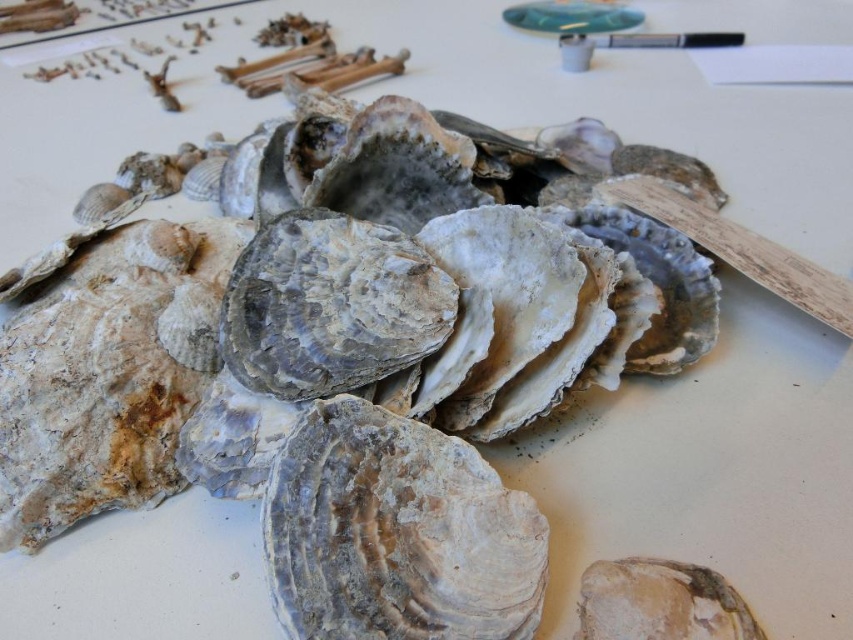
You are an archaeologist examining the shells. You need to determine which shell is taller between the rough textured shell at center and the speckled stone shell at center. Which one is taller?

The rough textured shell at center is much taller than the speckled stone shell at center, so the rough textured shell at center is taller.

You are an archaeologist examining the image of seashells. There is a gray textured shell at center located at point (x=396, y=532). What is the exact coordinate where you can find the gray textured shell at center?

The gray textured shell at center is located at point (x=396, y=532).